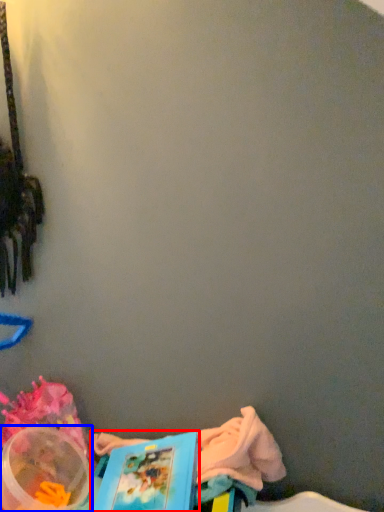
Question: Which object is closer to the camera taking this photo, book (highlighted by a red box) or storage box (highlighted by a blue box)?

Choices:
 (A) book
 (B) storage box

Answer: (A)